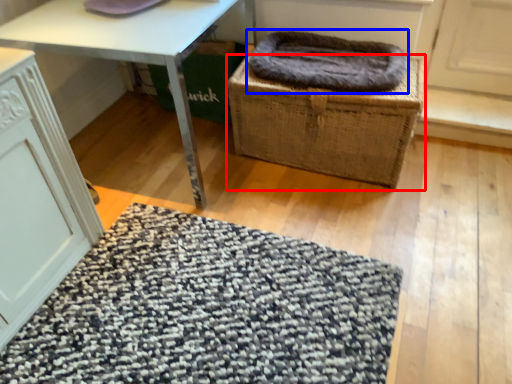
Question: Which point is closer to the camera, basket (highlighted by a red box) or blanket (highlighted by a blue box)?

Choices:
 (A) basket
 (B) blanket

Answer: (A)